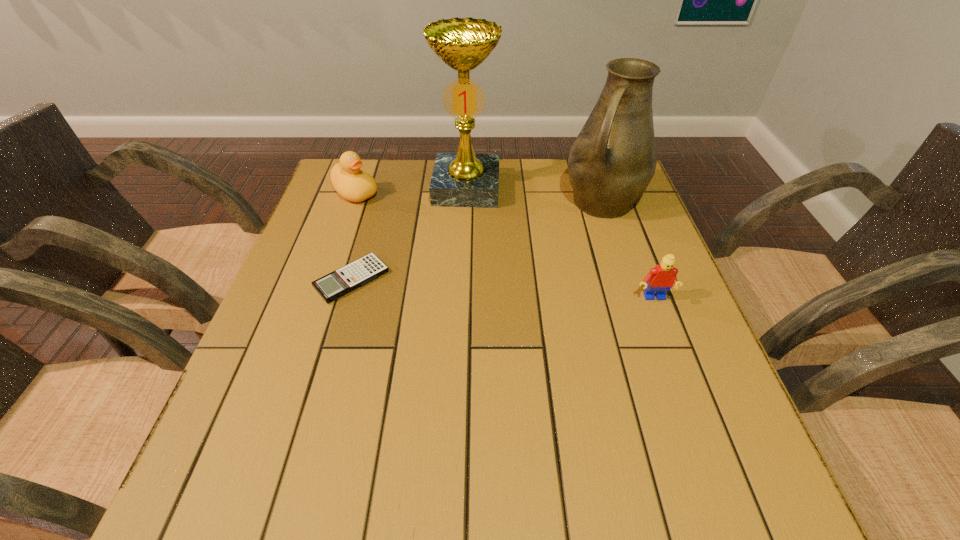
This screenshot has width=960, height=540. I want to click on object that ranks as the second closest to the duck, so click(x=338, y=283).